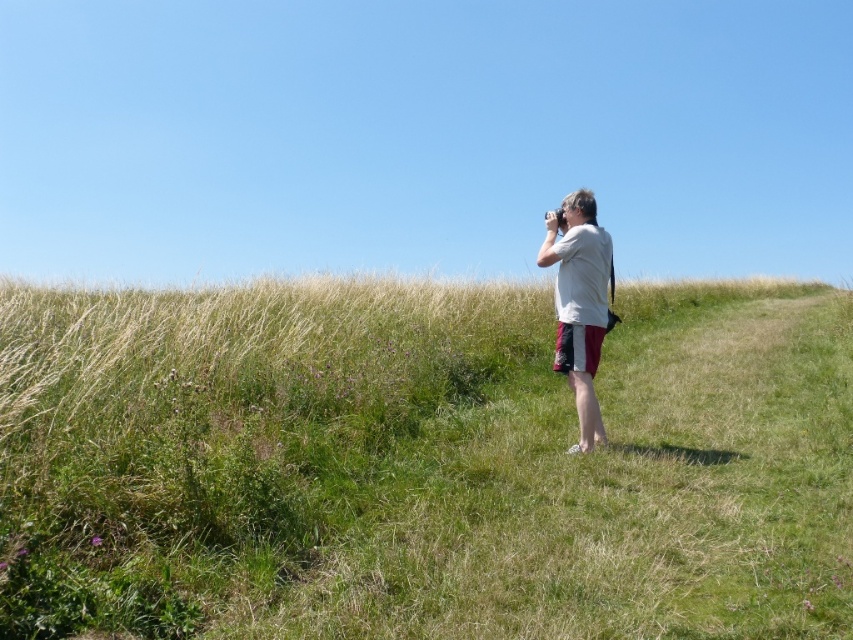
Question: Which point appears farthest from the camera in this image?

Choices:
 (A) (605, 259)
 (B) (833, 369)

Answer: (B)

Question: Can you confirm if green grassy hillside at center is thinner than white cotton shirt at center?

Choices:
 (A) yes
 (B) no

Answer: (B)

Question: Does green grassy hillside at center have a greater width compared to white cotton shirt at center?

Choices:
 (A) no
 (B) yes

Answer: (B)

Question: Is green grassy hillside at center to the right of white cotton shirt at center from the viewer's perspective?

Choices:
 (A) yes
 (B) no

Answer: (B)